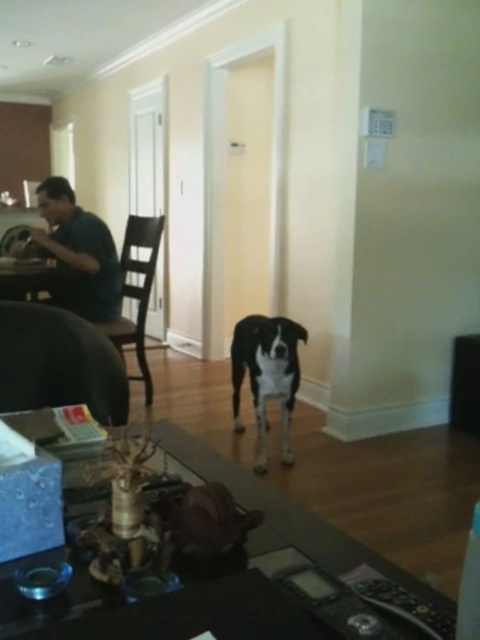
What object is located at the coordinates point (266, 376)?

The black matte dog at center is located at point (266, 376).

You are a guest in this room and want to sit down. You see the black matte dog at center and the brown wooden chair at left. Which object is a better option for sitting?

The brown wooden chair at left is a better option for sitting because it is larger than the black matte dog at center.